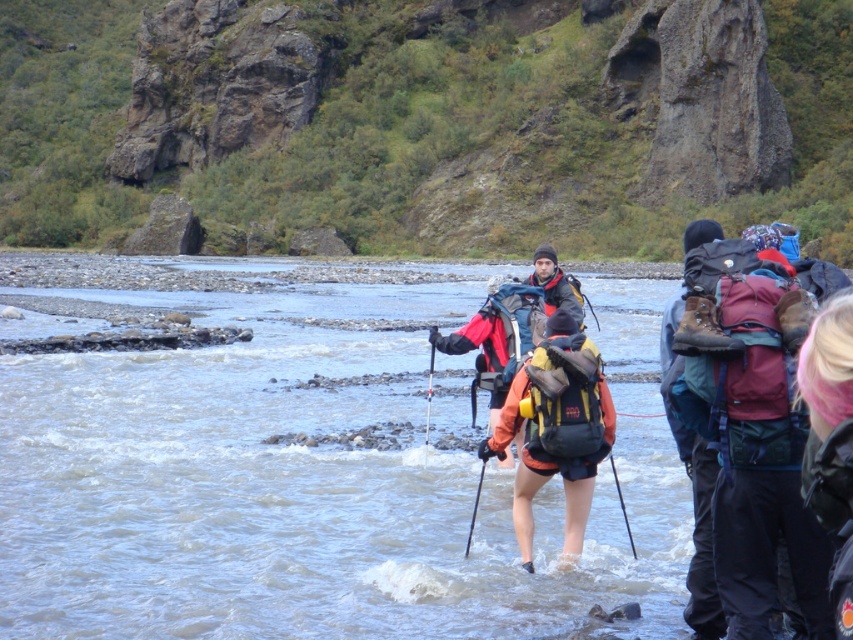
Question: Which object appears farthest from the camera in this image?

Choices:
 (A) pink hair at lower right
 (B) orange fabric backpack at center

Answer: (B)

Question: Is orange fabric backpack at center smaller than pink hair at lower right?

Choices:
 (A) no
 (B) yes

Answer: (A)

Question: Among these points, which one is farthest from the camera?

Choices:
 (A) (837, 588)
 (B) (531, 445)

Answer: (B)

Question: Does orange fabric backpack at center appear over pink hair at lower right?

Choices:
 (A) yes
 (B) no

Answer: (B)

Question: Is orange fabric backpack at center positioned before pink hair at lower right?

Choices:
 (A) yes
 (B) no

Answer: (B)